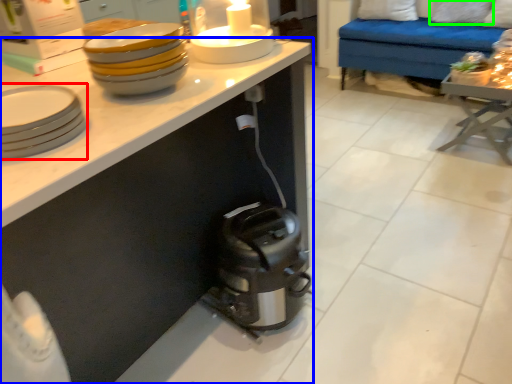
Question: Which object is the closest to the tableware (highlighted by a red box)? Choose among these: cabinetry (highlighted by a blue box) or pillow (highlighted by a green box).

Choices:
 (A) cabinetry
 (B) pillow

Answer: (A)